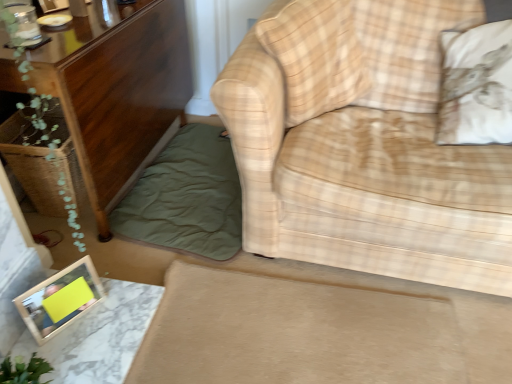
Question: From a real-world perspective, is white cotton pillow at upper right, which is counted as the first pillow, starting from the right, above or below beige plaid fabric couch at right?

Choices:
 (A) above
 (B) below

Answer: (A)

Question: From the image's perspective, is white cotton pillow at upper right, arranged as the second pillow when viewed from the left, located above or below beige plaid fabric couch at right?

Choices:
 (A) below
 (B) above

Answer: (B)

Question: Based on their relative distances, which object is nearer to the white cotton pillow at upper right, arranged as the second pillow when viewed from the left?

Choices:
 (A) wooden cabinet at left
 (B) wooden picture frame at lower left
 (C) green cotton blanket at lower left
 (D) green leafy plant at left
 (E) plaid fabric pillow at center, which ranks as the first pillow in left-to-right order

Answer: (E)

Question: Estimate the real-world distances between objects in this image. Which object is farther from the beige plaid fabric couch at right?

Choices:
 (A) white cotton pillow at upper right, arranged as the second pillow when viewed from the left
 (B) green leafy plant at left
 (C) wooden cabinet at left
 (D) wooden picture frame at lower left
 (E) plaid fabric pillow at center, the second pillow in the right-to-left sequence

Answer: (D)